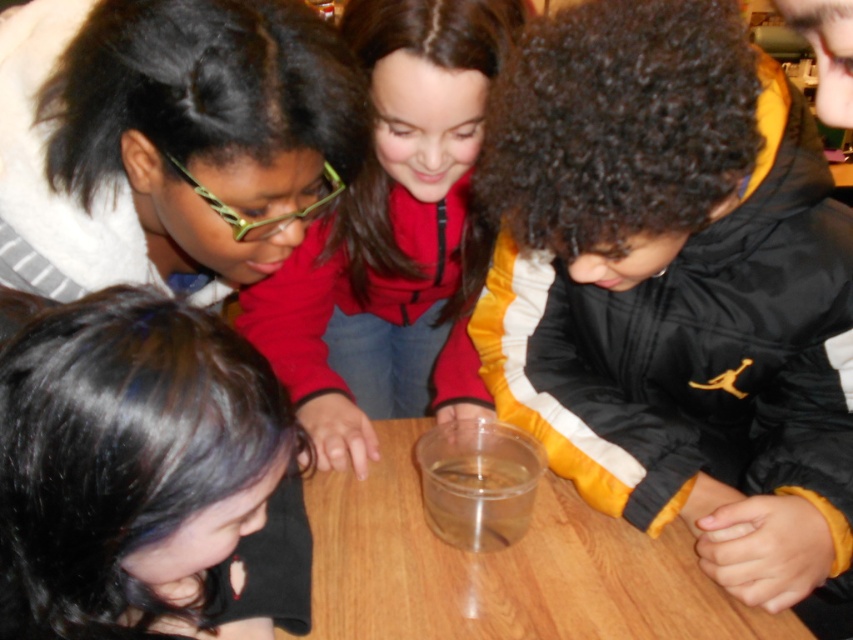
You are a teacher observing the children around the table. You need to place a new experiment kit that is wider than the transparent plastic cup at center. Will the transparent plastic table at center be wide enough to accommodate the new kit?

The transparent plastic table at center is wider than the transparent plastic cup at center. Since the new experiment kit is wider than the cup, it may still fit on the table, but the exact fit depends on the table and kit dimensions. However, based on the given information, the table is wider than the cup, so there is a possibility it can accommodate the kit.

You are a teacher observing the children around the table. You notice the matte black hair at upper left and the transparent plastic table at center. Which object is positioned higher from the ground?

The matte black hair at upper left is located above the transparent plastic table at center, so it is positioned higher from the ground than the table.

You are a teacher observing the children around the table. Which object is closer to you, the matte black hair at upper left or the transparent plastic table at center?

The matte black hair at upper left is closer to you because it is in front of the transparent plastic table at center.